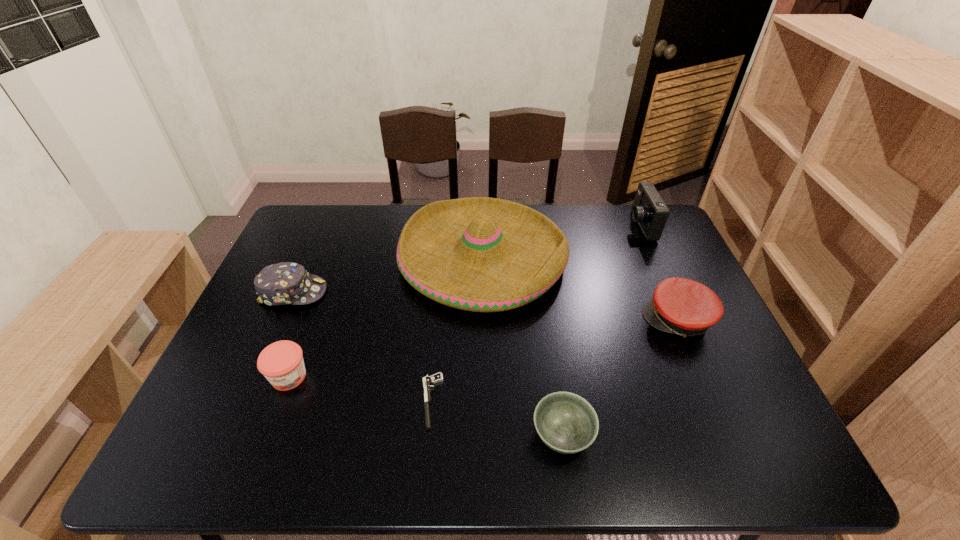
The height and width of the screenshot is (540, 960). Identify the location of free space located on the front-facing side of the second tallest object. (564, 226).

I want to click on free space located on the front-facing side of the left cap, so click(398, 292).

In order to click on free space located on the front of the right cap with an emblem in this screenshot , I will do `click(593, 320)`.

Locate an element on the screen. This screenshot has width=960, height=540. vacant space located on the front of the right cap with an emblem is located at coordinates (541, 320).

Image resolution: width=960 pixels, height=540 pixels. I want to click on blank space located on the front of the right cap with an emblem, so click(578, 320).

Identify the location of free location located 0.050m on the front label of the jam. (275, 414).

At what (x,y) coordinates should I click in order to perform the action: click on free spot located 0.100m on the left of the bowl. Please return your answer as a coordinate pair (x, y). This screenshot has width=960, height=540. Looking at the image, I should click on (486, 435).

This screenshot has height=540, width=960. Find the location of `free region located on the front-facing side of the shortest object`. free region located on the front-facing side of the shortest object is located at coordinates (300, 401).

You are a GUI agent. You are given a task and a screenshot of the screen. Output one action in this format:
    pyautogui.click(x=<x>, y=<y>)
    Task: Click on the vacant region located 0.250m on the front-facing side of the shortest object
    The width and height of the screenshot is (960, 540).
    Given the screenshot: What is the action you would take?
    pyautogui.click(x=313, y=401)

The width and height of the screenshot is (960, 540). In order to click on blank space located 0.300m on the front-facing side of the shortest object in this screenshot , I will do `click(291, 401)`.